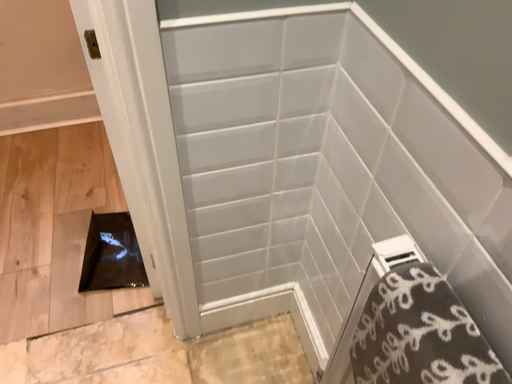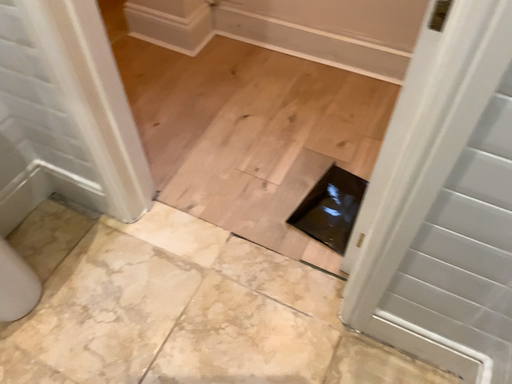
Question: Which way did the camera rotate in the video?

Choices:
 (A) rotated left
 (B) rotated right

Answer: (A)